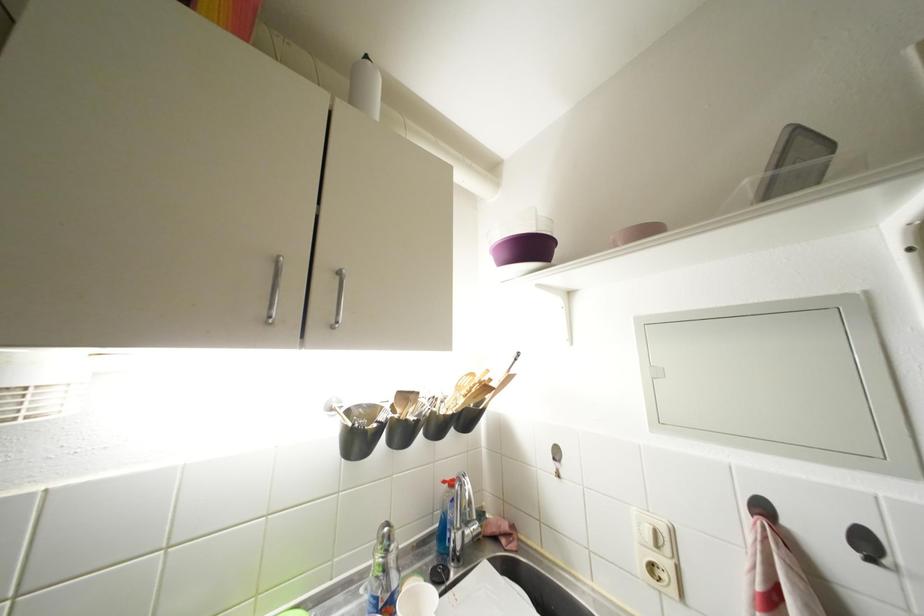
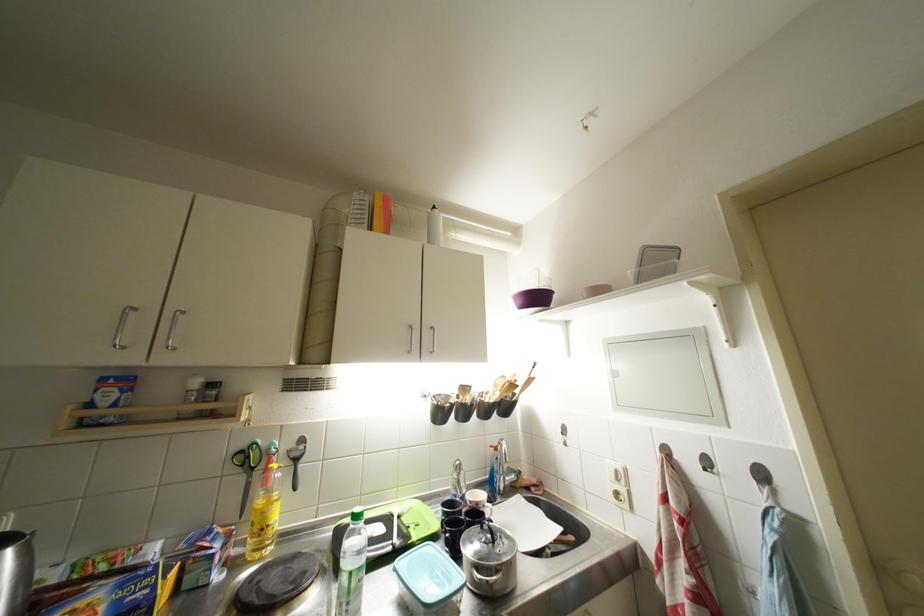
The point at (x=392, y=573) is marked in the first image. Where is the corresponding point in the second image?

(466, 487)